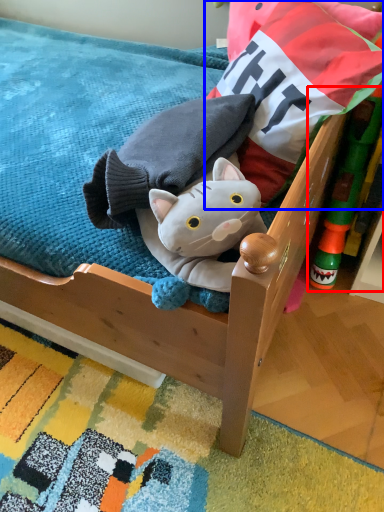
Question: Which object appears closest to the camera in this image, toy (highlighted by a red box) or pillow (highlighted by a blue box)?

Choices:
 (A) toy
 (B) pillow

Answer: (B)